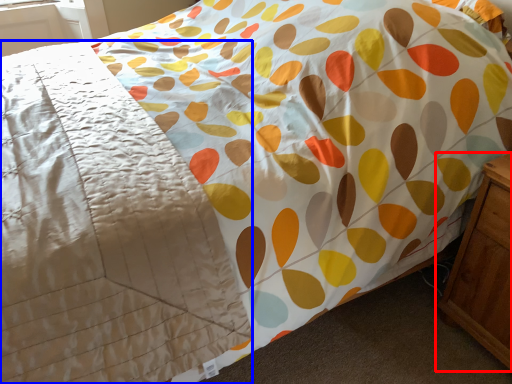
Question: Which object appears closest to the camera in this image, nightstand (highlighted by a red box) or blanket (highlighted by a blue box)?

Choices:
 (A) nightstand
 (B) blanket

Answer: (B)